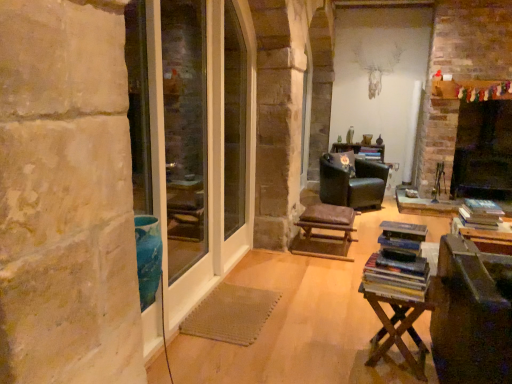
Find the location of a particular element. The image size is (512, 384). vacant space to the left of wooden table at lower right is located at coordinates (324, 348).